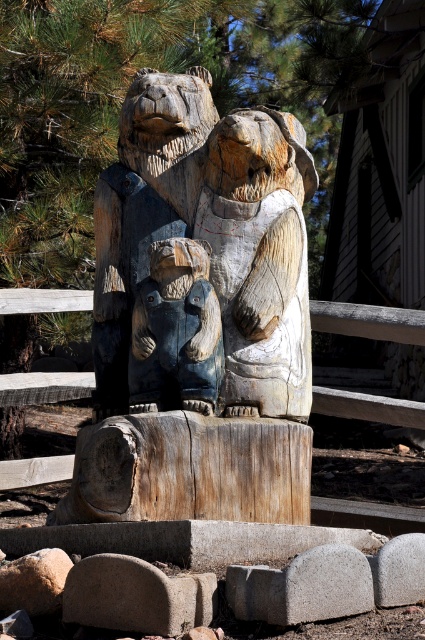
Question: Among these objects, which one is nearest to the camera?

Choices:
 (A) carved wood bear family at center
 (B) blue painted wood bear at center

Answer: (B)

Question: Which of the following is the farthest from the observer?

Choices:
 (A) carved wood bear family at center
 (B) blue painted wood bear at center

Answer: (A)

Question: Does carved wood bear family at center have a larger size compared to blue painted wood bear at center?

Choices:
 (A) no
 (B) yes

Answer: (B)

Question: Observing the image, what is the correct spatial positioning of carved wood bear family at center in reference to blue painted wood bear at center?

Choices:
 (A) left
 (B) right

Answer: (B)

Question: Which point is farther from the camera taking this photo?

Choices:
 (A) (295, 392)
 (B) (187, 346)

Answer: (A)

Question: Considering the relative positions of carved wood bear family at center and blue painted wood bear at center in the image provided, where is carved wood bear family at center located with respect to blue painted wood bear at center?

Choices:
 (A) right
 (B) left

Answer: (A)